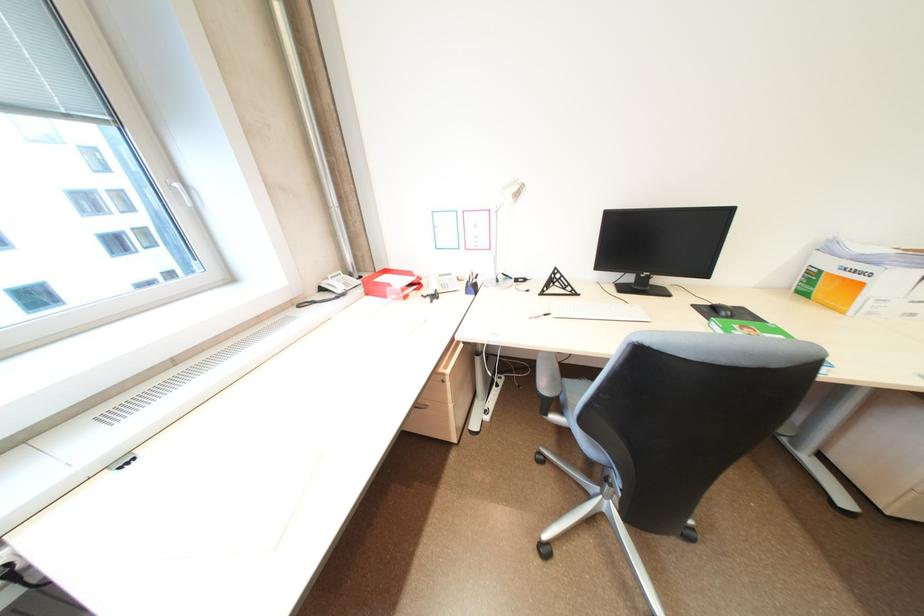
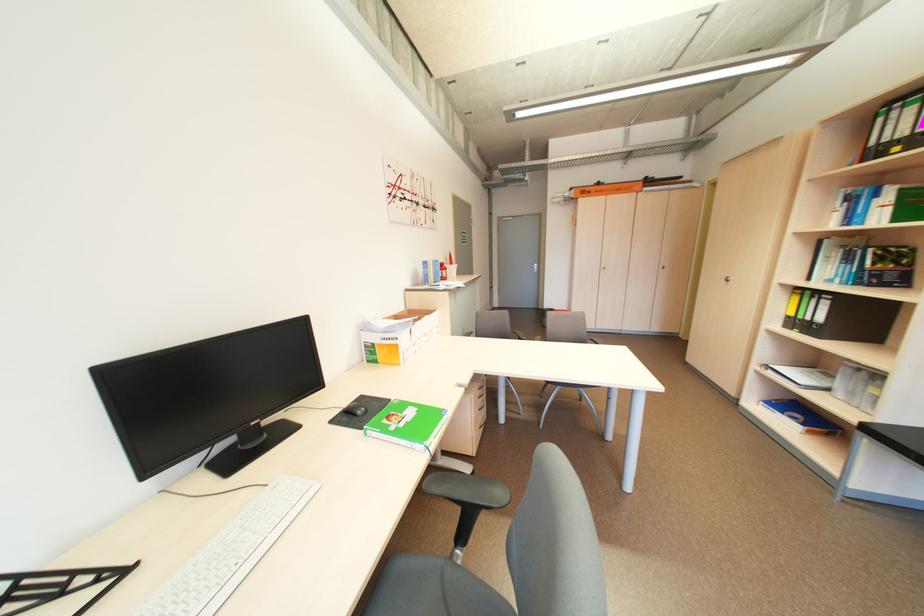
The point at (578, 290) is marked in the first image. Where is the corresponding point in the second image?

(91, 582)